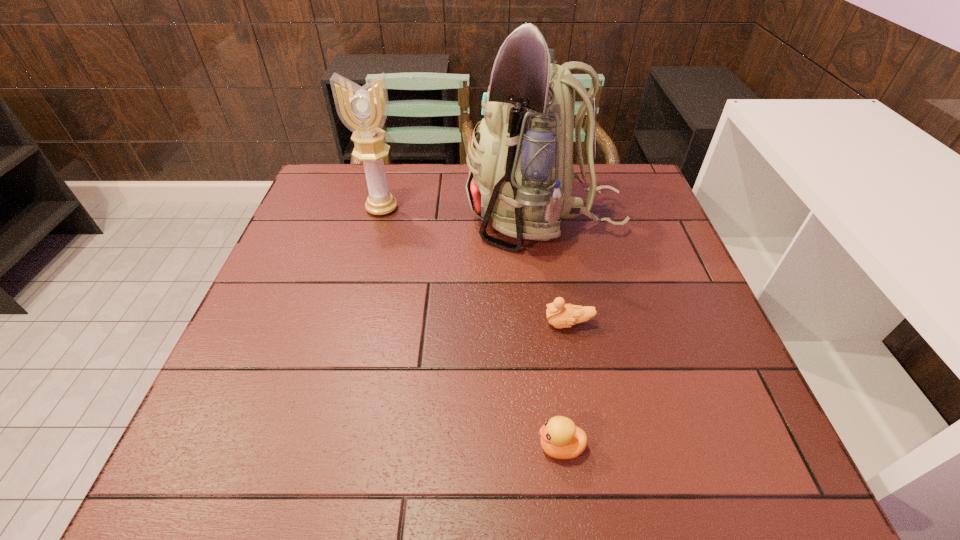
This screenshot has height=540, width=960. Find the location of `free space between the leftmost object and the second nearest object`. free space between the leftmost object and the second nearest object is located at coordinates (475, 266).

At what (x,y) coordinates should I click in order to perform the action: click on vacant area that lies between the second tallest object and the backpack. Please return your answer as a coordinate pair (x, y). The image size is (960, 540). Looking at the image, I should click on (463, 213).

Locate an element on the screen. The image size is (960, 540). vacant space that is in between the nearest object and the award is located at coordinates (471, 328).

Find the location of a particular element. vacant area between the farther duckling and the backpack is located at coordinates (556, 271).

You are a GUI agent. You are given a task and a screenshot of the screen. Output one action in this format:
    pyautogui.click(x=<x>, y=<y>)
    Task: Click on the vacant space in between the second nearest object and the tallest object
    The image size is (960, 540).
    Given the screenshot: What is the action you would take?
    pyautogui.click(x=556, y=271)

Where is `vacant space that is in between the backpack and the nearer duckling`? The width and height of the screenshot is (960, 540). vacant space that is in between the backpack and the nearer duckling is located at coordinates (552, 333).

Where is `the second closest object to the leftmost object`? This screenshot has width=960, height=540. the second closest object to the leftmost object is located at coordinates (560, 315).

Where is `object that is the third closest one to the nearest object`? object that is the third closest one to the nearest object is located at coordinates (363, 110).